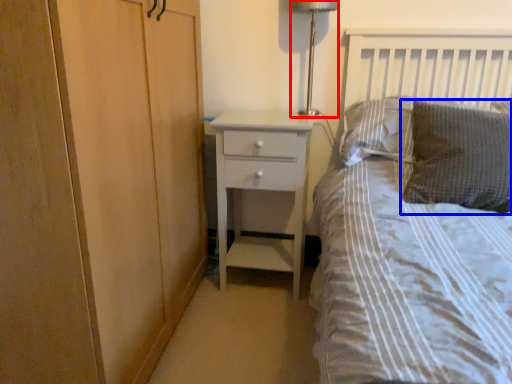
Question: Which object appears closest to the camera in this image, bedside lamp (highlighted by a red box) or pillow (highlighted by a blue box)?

Choices:
 (A) bedside lamp
 (B) pillow

Answer: (B)